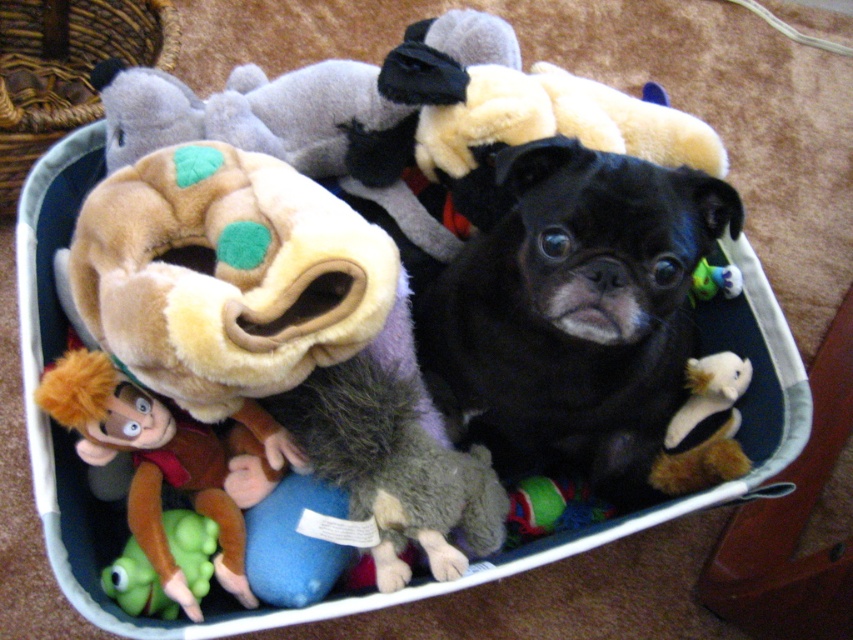
Who is taller, fuzzy white plush at lower right or green rubber toy at lower left?

fuzzy white plush at lower right is taller.

Which is below, fuzzy white plush at lower right or green rubber toy at lower left?

Positioned lower is green rubber toy at lower left.

Describe the element at coordinates (701, 420) in the screenshot. I see `fuzzy white plush at lower right` at that location.

Locate an element on the screen. The image size is (853, 640). fuzzy white plush at lower right is located at coordinates (701, 420).

What do you see at coordinates (573, 314) in the screenshot? I see `black soft dog at center` at bounding box center [573, 314].

The width and height of the screenshot is (853, 640). What do you see at coordinates (573, 314) in the screenshot?
I see `black soft dog at center` at bounding box center [573, 314].

Where is `black soft dog at center`? The width and height of the screenshot is (853, 640). black soft dog at center is located at coordinates coord(573,314).

Describe the element at coordinates (573, 314) in the screenshot. I see `black soft dog at center` at that location.

Who is more distant from viewer, (517, 182) or (747, 468)?

Point (747, 468)

Measure the distance between point (604, 250) and camera.

Point (604, 250) is 32.64 inches away from camera.

Locate an element on the screen. black soft dog at center is located at coordinates (573, 314).